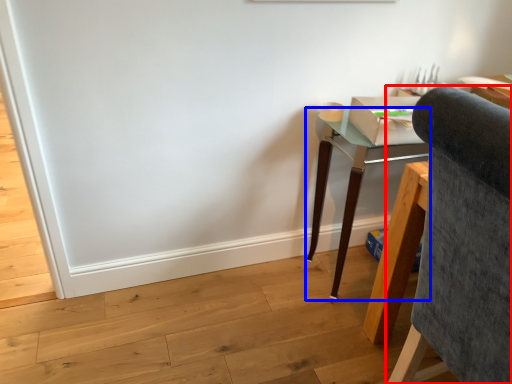
Question: Which object appears farthest to the camera in this image, chair (highlighted by a red box) or desk (highlighted by a blue box)?

Choices:
 (A) chair
 (B) desk

Answer: (B)